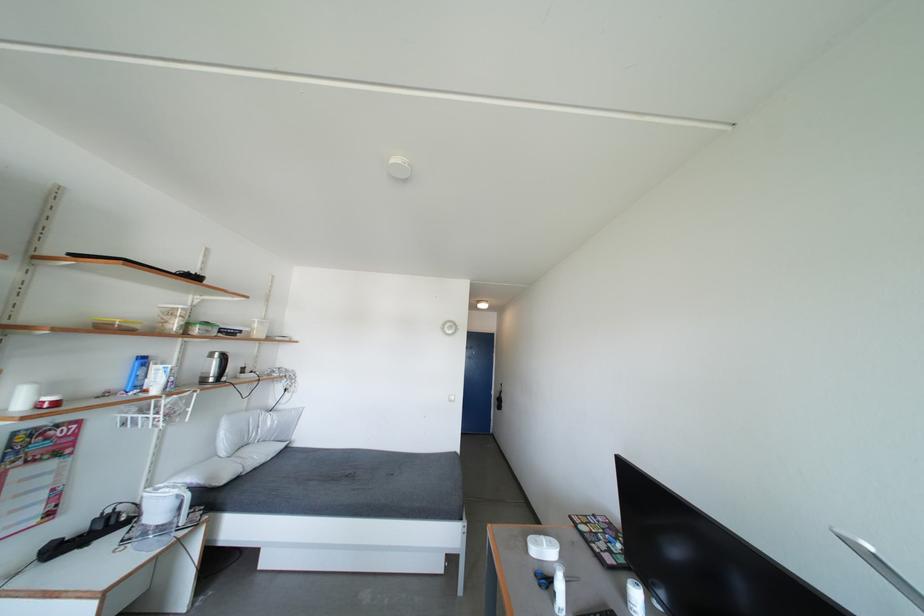
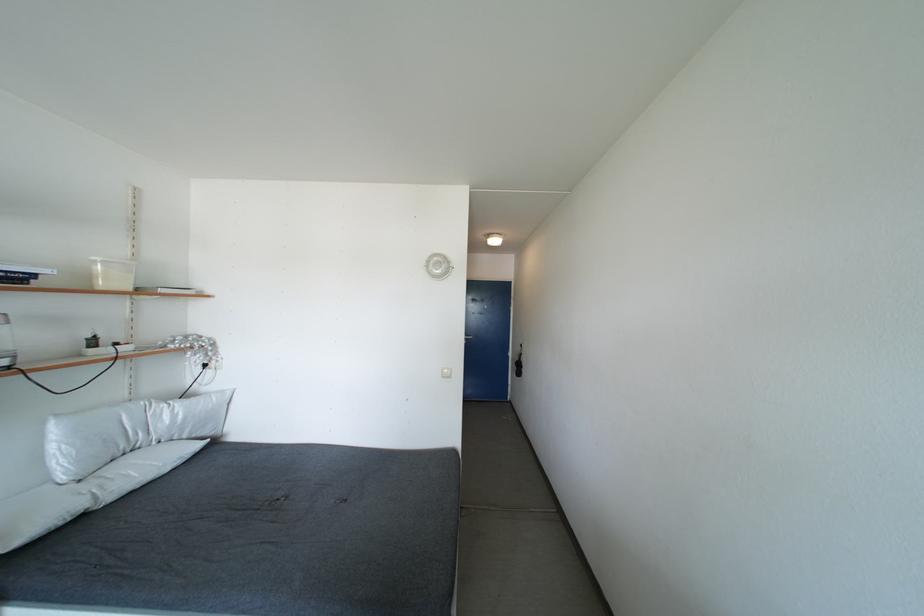
Question: In a continuous first-person perspective shot, in which direction is the camera moving?

Choices:
 (A) Left
 (B) Right
 (C) Forward
 (D) Backward

Answer: (C)